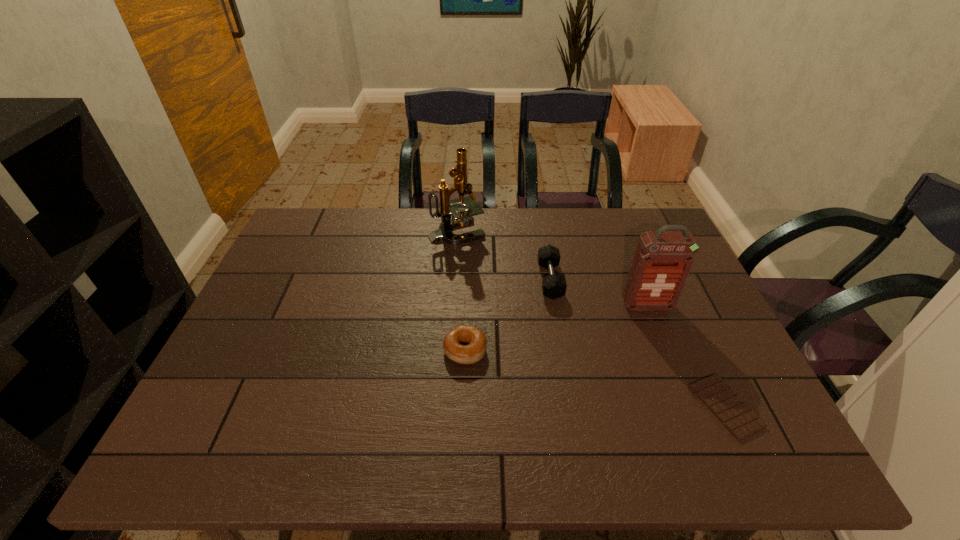
The width and height of the screenshot is (960, 540). Identify the location of vacant area between the fourth tallest object and the farthest object. (461, 291).

This screenshot has width=960, height=540. I want to click on free space between the dumbbell and the first-aid kit, so click(x=599, y=293).

The image size is (960, 540). Find the location of `free space between the farthest object and the third tallest object`. free space between the farthest object and the third tallest object is located at coordinates (503, 256).

Select which object is the third closest to the fourth farthest object. Please provide its 2D coordinates. Your answer should be formatted as a tuple, i.e. [(x, y)], where the tuple contains the x and y coordinates of a point satisfying the conditions above.

[(663, 259)]

Point out which object is positioned as the nearest to the shortest object. Please provide its 2D coordinates. Your answer should be formatted as a tuple, i.e. [(x, y)], where the tuple contains the x and y coordinates of a point satisfying the conditions above.

[(663, 259)]

Image resolution: width=960 pixels, height=540 pixels. I want to click on vacant space that satisfies the following two spatial constraints: 1. at the eyepiece of the microscope; 2. on the back side of the nearest object, so click(x=445, y=406).

The image size is (960, 540). I want to click on free spot that satisfies the following two spatial constraints: 1. at the eyepiece of the fourth farthest object; 2. on the right side of the microscope, so click(449, 350).

The image size is (960, 540). Find the location of `free space in the image that satisfies the following two spatial constraints: 1. on the front side of the shortest object; 2. on the right side of the dumbbell`. free space in the image that satisfies the following two spatial constraints: 1. on the front side of the shortest object; 2. on the right side of the dumbbell is located at coordinates (572, 406).

The image size is (960, 540). I want to click on vacant space that satisfies the following two spatial constraints: 1. on the back side of the chocolate bar; 2. at the eyepiece of the microscope, so click(x=644, y=231).

This screenshot has width=960, height=540. Find the location of `vacant area in the image that satisfies the following two spatial constraints: 1. at the eyepiece of the shortest object; 2. on the right side of the farthest object`. vacant area in the image that satisfies the following two spatial constraints: 1. at the eyepiece of the shortest object; 2. on the right side of the farthest object is located at coordinates (445, 406).